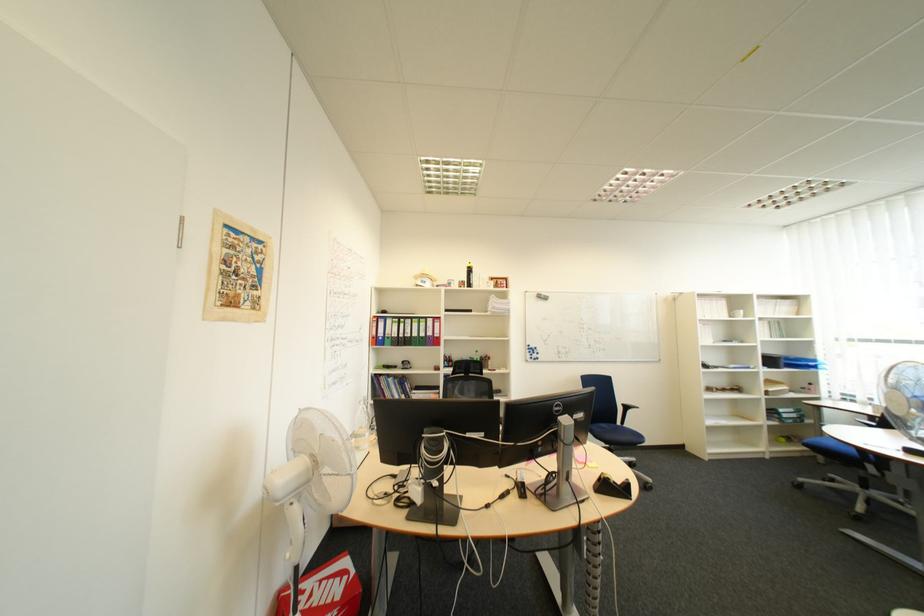
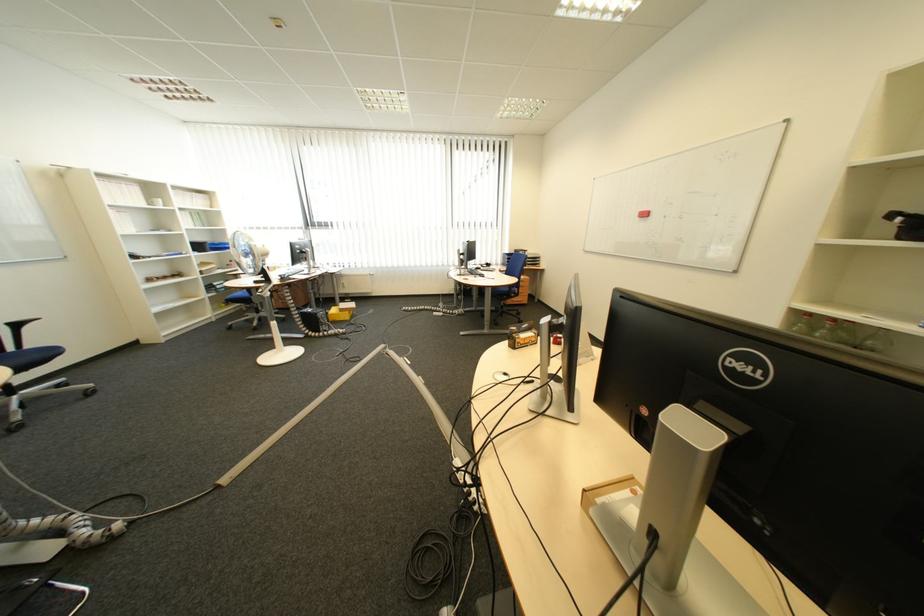
In the second image, find the point that corresponds to pixel 633 400 in the first image.

(13, 321)